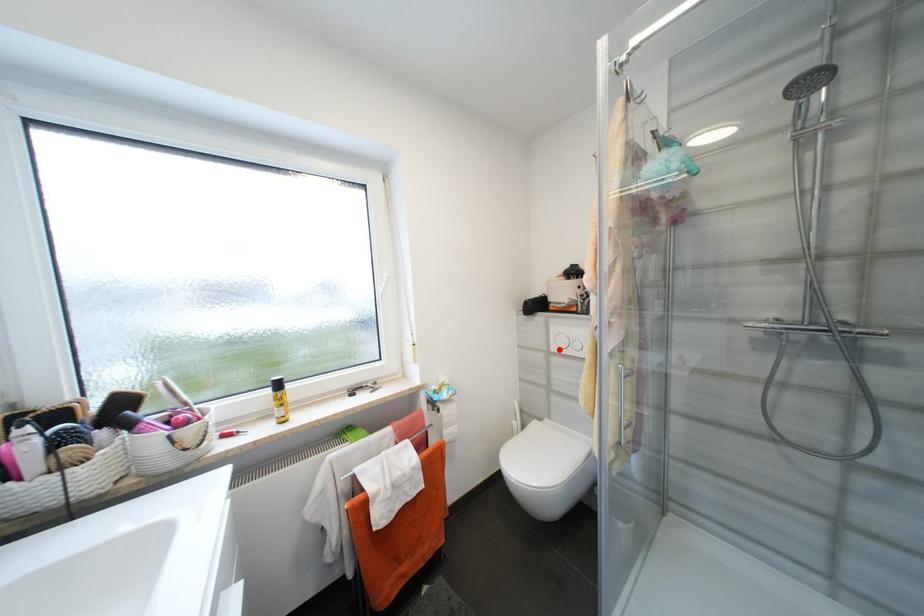
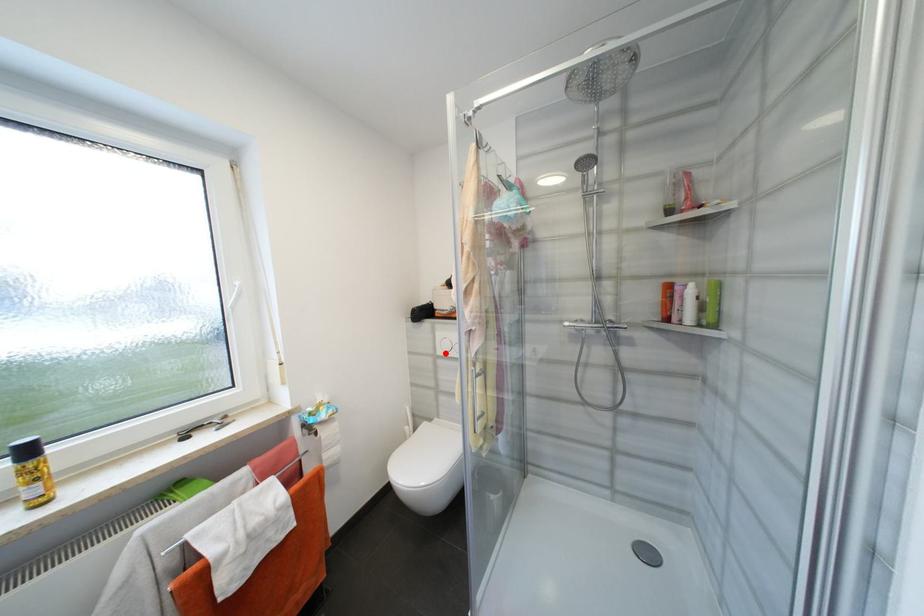
I am providing you with two images of the same scene from different viewpoints. A red point is marked on the first image and another point is marked on the second image. Is the red point in image1 aligned with the point shown in image2?

Yes